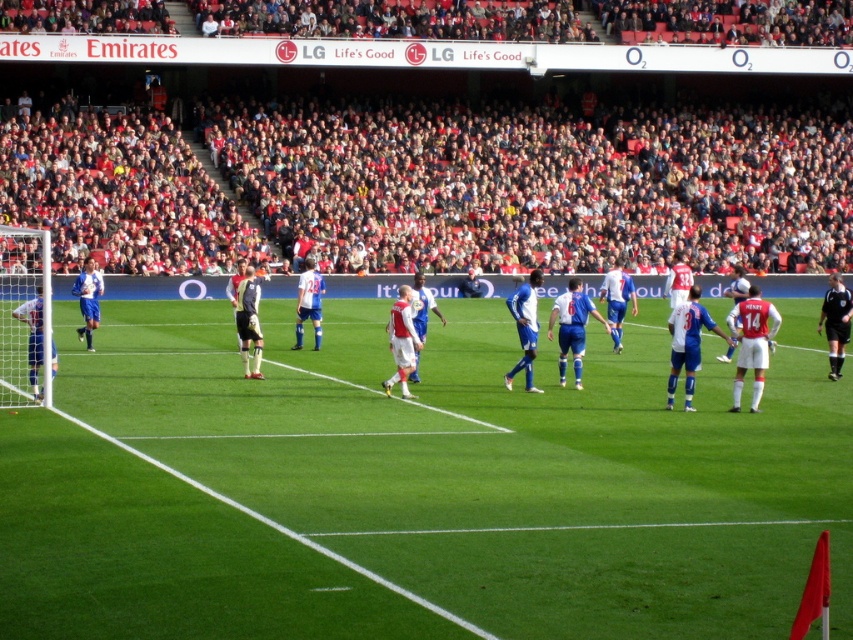
Between green grass field at center and dark red seats at upper center, which one has more height?

dark red seats at upper center is taller.

Between green grass field at center and dark red seats at upper center, which one has less height?

green grass field at center is shorter.

Does point (339, 355) come in front of point (436, 106)?

That is True.

Find the location of `green grass field at center`. green grass field at center is located at coordinates pos(500,467).

Measure the distance from white matte soccer ball at center to black uniform at right.

white matte soccer ball at center is 27.85 feet away from black uniform at right.

Does point (200, 294) come in front of point (838, 353)?

No, it is not.

Locate an element on the screen. white matte soccer ball at center is located at coordinates (45, 323).

Can you confirm if dark red seats at upper center is shorter than blue jersey at left?

In fact, dark red seats at upper center may be taller than blue jersey at left.

Between dark red seats at upper center and blue jersey at left, which one has more height?

dark red seats at upper center

The image size is (853, 640). What do you see at coordinates (538, 182) in the screenshot?
I see `dark red seats at upper center` at bounding box center [538, 182].

Locate an element on the screen. The width and height of the screenshot is (853, 640). dark red seats at upper center is located at coordinates tap(538, 182).